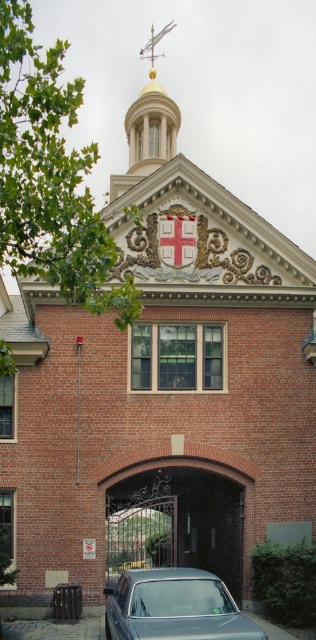
Is metallic wrought iron gate at center thinner than metallic silver car at lower center?

No.

I want to click on metallic wrought iron gate at center, so click(x=176, y=524).

Is metallic silver car at lower center closer to the viewer compared to gold polished metal spire at upper center?

Yes, it is.

Who is more forward, (194, 636) or (139, 140)?

Point (194, 636) is more forward.

The image size is (316, 640). What do you see at coordinates (174, 605) in the screenshot? I see `metallic silver car at lower center` at bounding box center [174, 605].

Where is `metallic silver car at lower center`? Image resolution: width=316 pixels, height=640 pixels. metallic silver car at lower center is located at coordinates (174, 605).

Can you confirm if metallic wrought iron gate at center is shorter than gold polished metal spire at upper center?

Correct, metallic wrought iron gate at center is not as tall as gold polished metal spire at upper center.

Is metallic wrought iron gate at center to the left of gold polished metal spire at upper center from the viewer's perspective?

No, metallic wrought iron gate at center is not to the left of gold polished metal spire at upper center.

Does point (174, 548) come in front of point (150, 99)?

That is True.

Find the location of a particular element. This screenshot has height=640, width=316. metallic wrought iron gate at center is located at coordinates (176, 524).